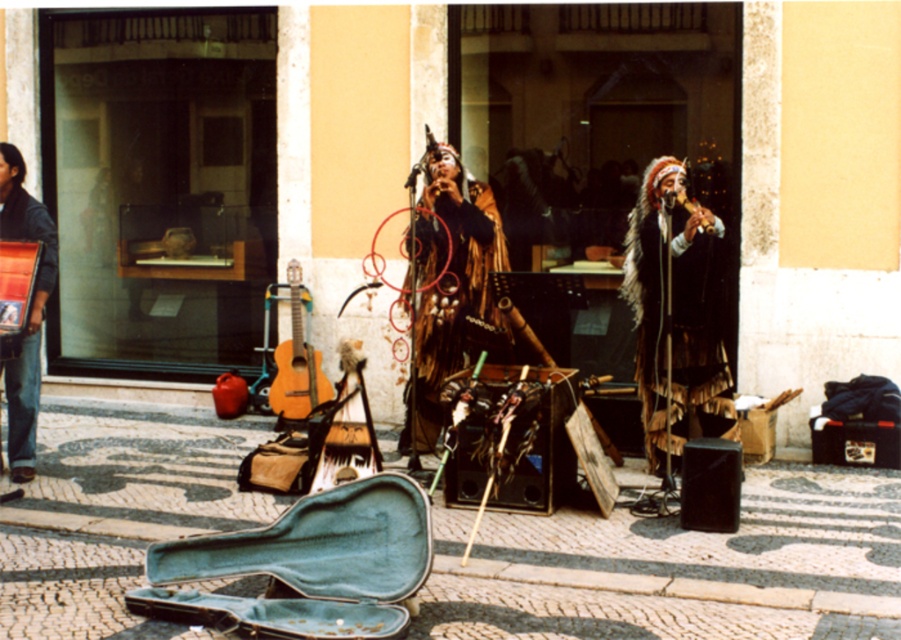
Question: Does cobblestone pavement at center appear under fur-like brown coat at center?

Choices:
 (A) yes
 (B) no

Answer: (A)

Question: Which of the following is the farthest from the observer?

Choices:
 (A) (492, 323)
 (B) (120, 529)
 (C) (39, 372)
 (D) (298, 406)

Answer: (D)

Question: Which object appears farthest from the camera in this image?

Choices:
 (A) brushed metal accordion at lower left
 (B) fur-like brown coat at center
 (C) light brown wooden guitar at center

Answer: (C)

Question: Where is fur-like costume at center located in relation to fur-like brown coat at center in the image?

Choices:
 (A) above
 (B) below

Answer: (B)

Question: Which of the following is the closest to the observer?

Choices:
 (A) (647, 260)
 (B) (458, 556)

Answer: (B)

Question: Is fur-like brown coat at center positioned behind brushed metal accordion at lower left?

Choices:
 (A) yes
 (B) no

Answer: (A)